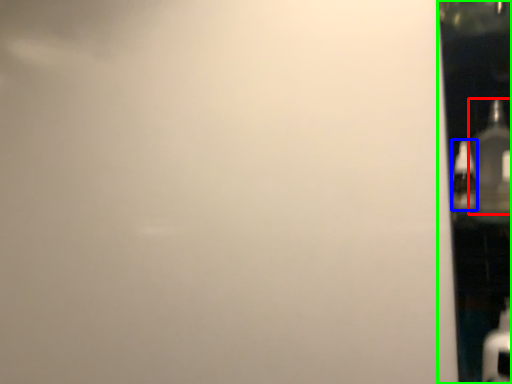
Question: Estimate the real-world distances between objects in this image. Which object is closer to bottle (highlighted by a red box), bottle (highlighted by a blue box) or glass door (highlighted by a green box)?

Choices:
 (A) bottle
 (B) glass door

Answer: (A)